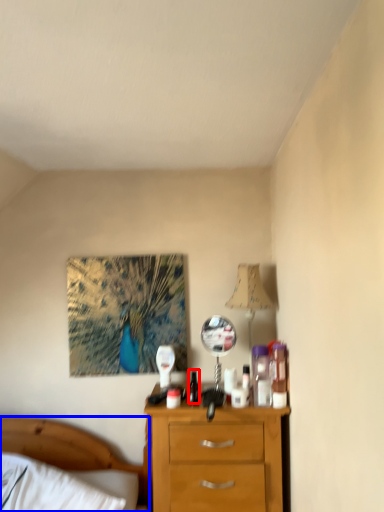
Question: Which of the following is the farthest to the observer, bottle (highlighted by a red box) or bed (highlighted by a blue box)?

Choices:
 (A) bottle
 (B) bed

Answer: (A)